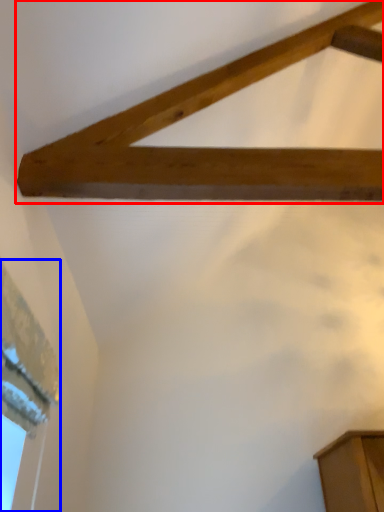
Question: Which of the following is the farthest to the observer, plank (highlighted by a red box) or window (highlighted by a blue box)?

Choices:
 (A) plank
 (B) window

Answer: (A)